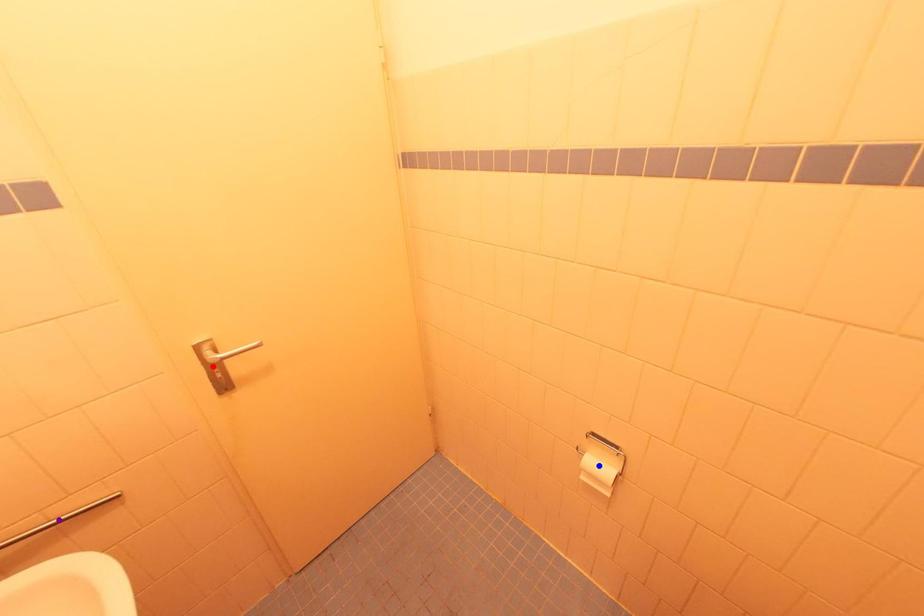
Order these from nearest to farthest:
blue point, red point, purple point

blue point, red point, purple point